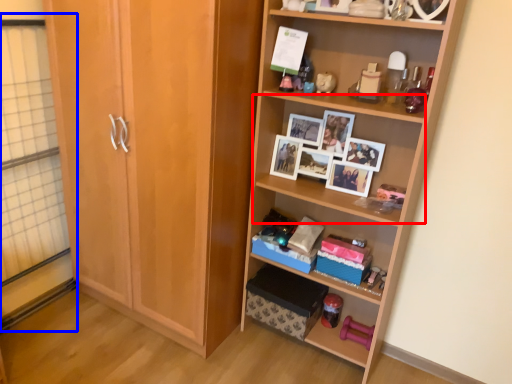
Question: Which object appears farthest to the camera in this image, shelf (highlighted by a red box) or glass door (highlighted by a blue box)?

Choices:
 (A) shelf
 (B) glass door

Answer: (A)